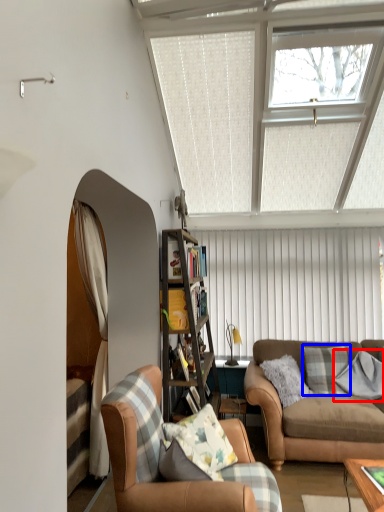
Question: Which object is further to the camera taking this photo, pillow (highlighted by a red box) or pillow (highlighted by a blue box)?

Choices:
 (A) pillow
 (B) pillow

Answer: (B)